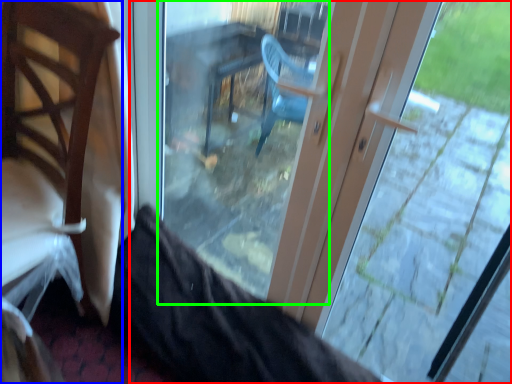
Question: Based on their relative distances, which object is nearer to door (highlighted by a red box)? Choose from chair (highlighted by a blue box) and glass door (highlighted by a green box).

Choices:
 (A) chair
 (B) glass door

Answer: (B)